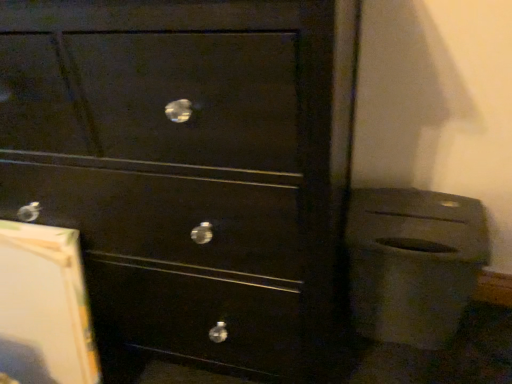
Question: Does matte black trash can at lower right come behind matte black drawer at center?

Choices:
 (A) no
 (B) yes

Answer: (B)

Question: Would you say matte black trash can at lower right is outside matte black drawer at center?

Choices:
 (A) yes
 (B) no

Answer: (A)

Question: Is matte black trash can at lower right in front of matte black drawer at center?

Choices:
 (A) no
 (B) yes

Answer: (A)

Question: Does matte black trash can at lower right appear on the right side of matte black drawer at center?

Choices:
 (A) no
 (B) yes

Answer: (B)

Question: Can you confirm if matte black trash can at lower right is bigger than matte black drawer at center?

Choices:
 (A) yes
 (B) no

Answer: (B)

Question: Can you confirm if matte black trash can at lower right is taller than matte black drawer at center?

Choices:
 (A) yes
 (B) no

Answer: (B)

Question: From the image's perspective, would you say matte black drawer at center is shown under matte black trash can at lower right?

Choices:
 (A) yes
 (B) no

Answer: (B)

Question: Does matte black drawer at center turn towards matte black trash can at lower right?

Choices:
 (A) no
 (B) yes

Answer: (A)

Question: From the image's perspective, would you say matte black drawer at center is positioned over matte black trash can at lower right?

Choices:
 (A) yes
 (B) no

Answer: (A)

Question: Does matte black drawer at center have a greater width compared to matte black trash can at lower right?

Choices:
 (A) yes
 (B) no

Answer: (A)

Question: Is matte black drawer at center smaller than matte black trash can at lower right?

Choices:
 (A) no
 (B) yes

Answer: (A)

Question: Does matte black drawer at center lie behind matte black trash can at lower right?

Choices:
 (A) no
 (B) yes

Answer: (A)

Question: Considering the positions of matte black trash can at lower right and matte black drawer at center in the image, is matte black trash can at lower right taller or shorter than matte black drawer at center?

Choices:
 (A) short
 (B) tall

Answer: (A)